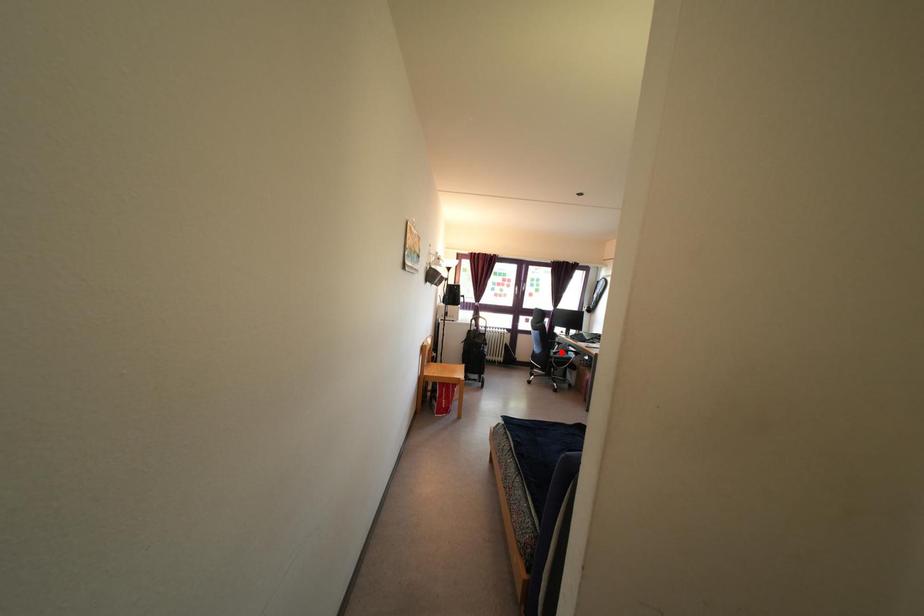
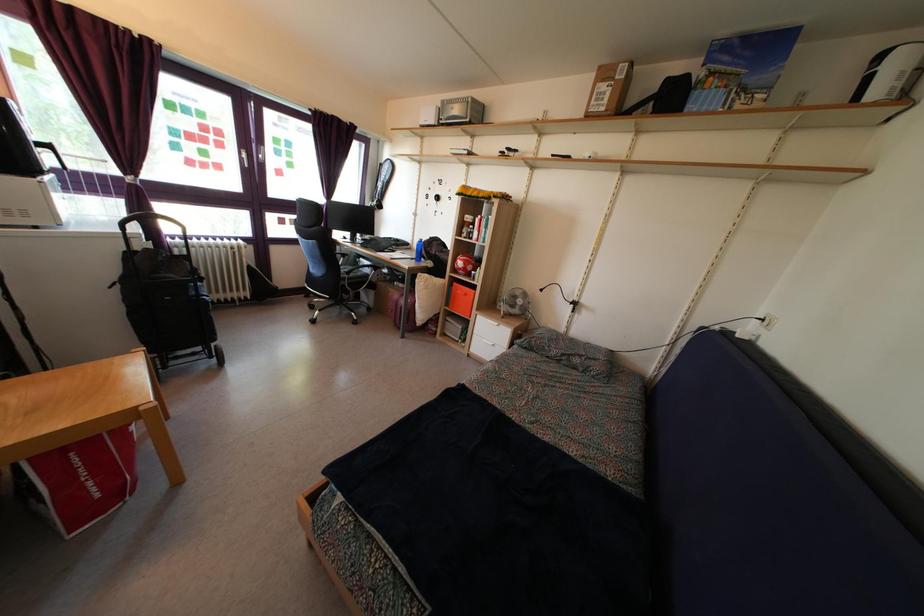
The point at the highlighted location is marked in the first image. Where is the corresponding point in the second image?

(346, 264)